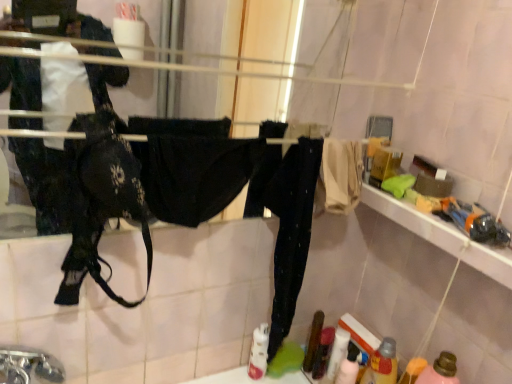
This screenshot has height=384, width=512. What do you see at coordinates (28, 365) in the screenshot?
I see `silver metallic faucet at lower left` at bounding box center [28, 365].

Locate an element on the screen. The image size is (512, 384). pink matte bottle at lower right, which is counted as the 2th bottle, starting from the left is located at coordinates (440, 370).

At what (x,y) coordinates should I click in order to perform the action: click on translucent plastic bottle at lower right, which ranks as the 2th bottle in right-to-left order. Please return your answer as a coordinate pair (x, y). This screenshot has width=512, height=384. Looking at the image, I should click on (382, 364).

The height and width of the screenshot is (384, 512). Find the location of `silver metallic faucet at lower left`. silver metallic faucet at lower left is located at coordinates (28, 365).

Considering the sizes of silver metallic faucet at lower left and pink matte bottle at lower right, placed as the first bottle when sorted from right to left, in the image, is silver metallic faucet at lower left taller or shorter than pink matte bottle at lower right, placed as the first bottle when sorted from right to left,?

Considering their sizes, silver metallic faucet at lower left has less height than pink matte bottle at lower right, placed as the first bottle when sorted from right to left.

From the picture: Is silver metallic faucet at lower left positioned with its back to pink matte bottle at lower right, placed as the first bottle when sorted from right to left?

No, pink matte bottle at lower right, placed as the first bottle when sorted from right to left, is not at the back of silver metallic faucet at lower left.

Is point (47, 371) less distant than point (430, 372)?

Yes, it is in front of point (430, 372).

From the image's perspective, is silver metallic faucet at lower left on pink matte bottle at lower right, placed as the first bottle when sorted from right to left?

Indeed, from the image's perspective, silver metallic faucet at lower left is shown above pink matte bottle at lower right, placed as the first bottle when sorted from right to left.

Could you tell me if translucent plastic bottle at lower right, positioned as the 1th bottle in left-to-right order, is turned towards silver metallic faucet at lower left?

Yes, translucent plastic bottle at lower right, positioned as the 1th bottle in left-to-right order, is turned towards silver metallic faucet at lower left.

Is translucent plastic bottle at lower right, which ranks as the 2th bottle in right-to-left order, completely or partially outside of silver metallic faucet at lower left?

Indeed, translucent plastic bottle at lower right, which ranks as the 2th bottle in right-to-left order, is completely outside silver metallic faucet at lower left.

From a real-world perspective, is translucent plastic bottle at lower right, which ranks as the 2th bottle in right-to-left order, physically below silver metallic faucet at lower left?

Yes, from a real-world perspective, translucent plastic bottle at lower right, which ranks as the 2th bottle in right-to-left order, is beneath silver metallic faucet at lower left.

Considering the relative positions of translucent plastic bottle at lower right, positioned as the 1th bottle in left-to-right order, and silver metallic faucet at lower left in the image provided, is translucent plastic bottle at lower right, positioned as the 1th bottle in left-to-right order, to the right of silver metallic faucet at lower left from the viewer's perspective?

Yes, translucent plastic bottle at lower right, positioned as the 1th bottle in left-to-right order, is to the right of silver metallic faucet at lower left.

Is point (42, 369) positioned behind point (388, 338)?

No, it is not.

Can you tell me how much silver metallic faucet at lower left and translucent plastic bottle at lower right, positioned as the 1th bottle in left-to-right order, differ in facing direction?

102 degrees separate the facing orientations of silver metallic faucet at lower left and translucent plastic bottle at lower right, positioned as the 1th bottle in left-to-right order.

Can you confirm if silver metallic faucet at lower left is taller than translucent plastic bottle at lower right, positioned as the 1th bottle in left-to-right order?

Incorrect, the height of silver metallic faucet at lower left is not larger of that of translucent plastic bottle at lower right, positioned as the 1th bottle in left-to-right order.

From the image's perspective, is silver metallic faucet at lower left beneath translucent plastic bottle at lower right, positioned as the 1th bottle in left-to-right order?

No, from the image's perspective, silver metallic faucet at lower left is not below translucent plastic bottle at lower right, positioned as the 1th bottle in left-to-right order.

At what (x,y) coordinates should I click in order to perform the action: click on bottle positioned vertically above the translucent plastic bottle at lower right, positioned as the 1th bottle in left-to-right order (from a real-world perspective). Please return your answer as a coordinate pair (x, y). The height and width of the screenshot is (384, 512). Looking at the image, I should click on (440, 370).

Which object is positioned more to the left, pink matte bottle at lower right, which is counted as the 2th bottle, starting from the left, or translucent plastic bottle at lower right, which ranks as the 2th bottle in right-to-left order?

From the viewer's perspective, translucent plastic bottle at lower right, which ranks as the 2th bottle in right-to-left order, appears more on the left side.

Is pink matte bottle at lower right, placed as the first bottle when sorted from right to left, bigger or smaller than translucent plastic bottle at lower right, positioned as the 1th bottle in left-to-right order?

In the image, pink matte bottle at lower right, placed as the first bottle when sorted from right to left, appears to be larger than translucent plastic bottle at lower right, positioned as the 1th bottle in left-to-right order.

Which is behind, point (454, 373) or point (396, 369)?

The point (396, 369) is farther from the camera.

Which of these two, translucent plastic bottle at lower right, positioned as the 1th bottle in left-to-right order, or pink matte bottle at lower right, placed as the first bottle when sorted from right to left, is thinner?

translucent plastic bottle at lower right, positioned as the 1th bottle in left-to-right order, is thinner.

Can pink matte bottle at lower right, which is counted as the 2th bottle, starting from the left, be found inside translucent plastic bottle at lower right, positioned as the 1th bottle in left-to-right order?

That's incorrect, pink matte bottle at lower right, which is counted as the 2th bottle, starting from the left, is not inside translucent plastic bottle at lower right, positioned as the 1th bottle in left-to-right order.

From the image's perspective, which object appears higher, translucent plastic bottle at lower right, positioned as the 1th bottle in left-to-right order, or pink matte bottle at lower right, placed as the first bottle when sorted from right to left?

translucent plastic bottle at lower right, positioned as the 1th bottle in left-to-right order, appears higher in the image.

Could you measure the distance between translucent plastic bottle at lower right, positioned as the 1th bottle in left-to-right order, and pink matte bottle at lower right, placed as the first bottle when sorted from right to left?

4.60 inches.

Considering the positions of point (448, 377) and point (6, 381), is point (448, 377) closer or farther from the camera than point (6, 381)?

Clearly, point (448, 377) is more distant from the camera than point (6, 381).

Considering the sizes of objects pink matte bottle at lower right, which is counted as the 2th bottle, starting from the left, and silver metallic faucet at lower left in the image provided, who is thinner, pink matte bottle at lower right, which is counted as the 2th bottle, starting from the left, or silver metallic faucet at lower left?

Thinner between the two is pink matte bottle at lower right, which is counted as the 2th bottle, starting from the left.

Based on the photo, from a real-world perspective, which is physically above, pink matte bottle at lower right, which is counted as the 2th bottle, starting from the left, or silver metallic faucet at lower left?

In real-world perspective, silver metallic faucet at lower left is above.

From the picture: From the image's perspective, who appears lower, pink matte bottle at lower right, which is counted as the 2th bottle, starting from the left, or silver metallic faucet at lower left?

pink matte bottle at lower right, which is counted as the 2th bottle, starting from the left, from the image's perspective.

In order to click on faucet located above the pink matte bottle at lower right, which is counted as the 2th bottle, starting from the left (from the image's perspective) in this screenshot , I will do `click(28, 365)`.

In order to click on faucet that is on the left side of translucent plastic bottle at lower right, which ranks as the 2th bottle in right-to-left order in this screenshot , I will do `click(28, 365)`.

Which object lies nearer to the anchor point pink matte bottle at lower right, placed as the first bottle when sorted from right to left, translucent plastic bottle at lower right, which ranks as the 2th bottle in right-to-left order, or silver metallic faucet at lower left?

translucent plastic bottle at lower right, which ranks as the 2th bottle in right-to-left order, lies closer to pink matte bottle at lower right, placed as the first bottle when sorted from right to left, than the other object.

Considering their positions, is silver metallic faucet at lower left positioned further to pink matte bottle at lower right, placed as the first bottle when sorted from right to left, than translucent plastic bottle at lower right, which ranks as the 2th bottle in right-to-left order?

silver metallic faucet at lower left.

Estimate the real-world distances between objects in this image. Which object is further from translucent plastic bottle at lower right, which ranks as the 2th bottle in right-to-left order, silver metallic faucet at lower left or pink matte bottle at lower right, placed as the first bottle when sorted from right to left?

silver metallic faucet at lower left lies further to translucent plastic bottle at lower right, which ranks as the 2th bottle in right-to-left order, than the other object.

When comparing their distances from silver metallic faucet at lower left, does translucent plastic bottle at lower right, which ranks as the 2th bottle in right-to-left order, or pink matte bottle at lower right, placed as the first bottle when sorted from right to left, seem further?

pink matte bottle at lower right, placed as the first bottle when sorted from right to left, lies further to silver metallic faucet at lower left than the other object.

From the image, which object appears to be nearer to silver metallic faucet at lower left, pink matte bottle at lower right, which is counted as the 2th bottle, starting from the left, or translucent plastic bottle at lower right, which ranks as the 2th bottle in right-to-left order?

translucent plastic bottle at lower right, which ranks as the 2th bottle in right-to-left order, is closer to silver metallic faucet at lower left.

Based on their spatial positions, is pink matte bottle at lower right, which is counted as the 2th bottle, starting from the left, or silver metallic faucet at lower left closer to translucent plastic bottle at lower right, which ranks as the 2th bottle in right-to-left order?

pink matte bottle at lower right, which is counted as the 2th bottle, starting from the left, is positioned closer to the anchor translucent plastic bottle at lower right, which ranks as the 2th bottle in right-to-left order.

The width and height of the screenshot is (512, 384). In order to click on bottle between silver metallic faucet at lower left and pink matte bottle at lower right, placed as the first bottle when sorted from right to left, from left to right in this screenshot , I will do `click(382, 364)`.